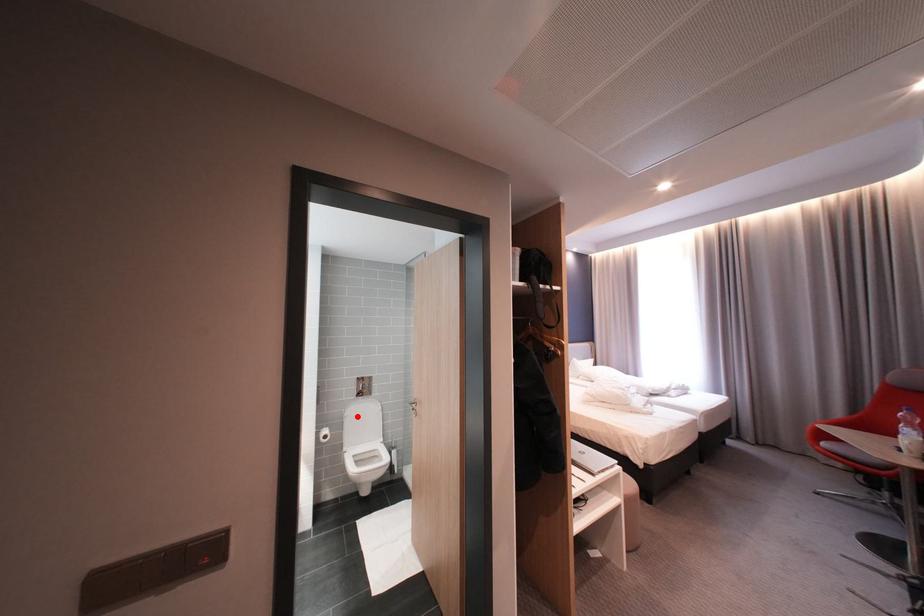
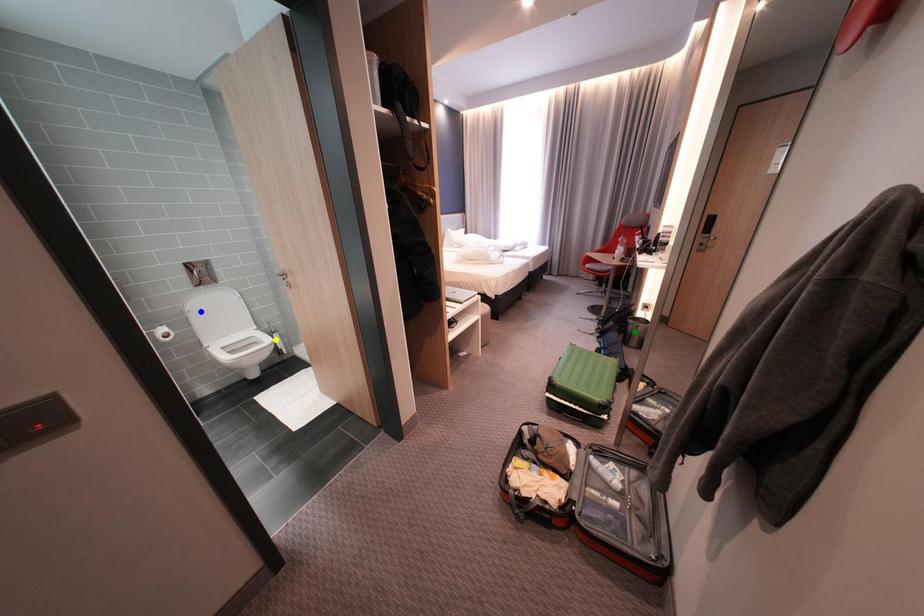
Question: I am providing you with two images of the same scene from different viewpoints. A red point is marked on the first image. You are given multiple points on the second image. Which spot in image 2 lines up with the point in image 1?

Choices:
 (A) blue point
 (B) yellow point
 (C) green point

Answer: (A)